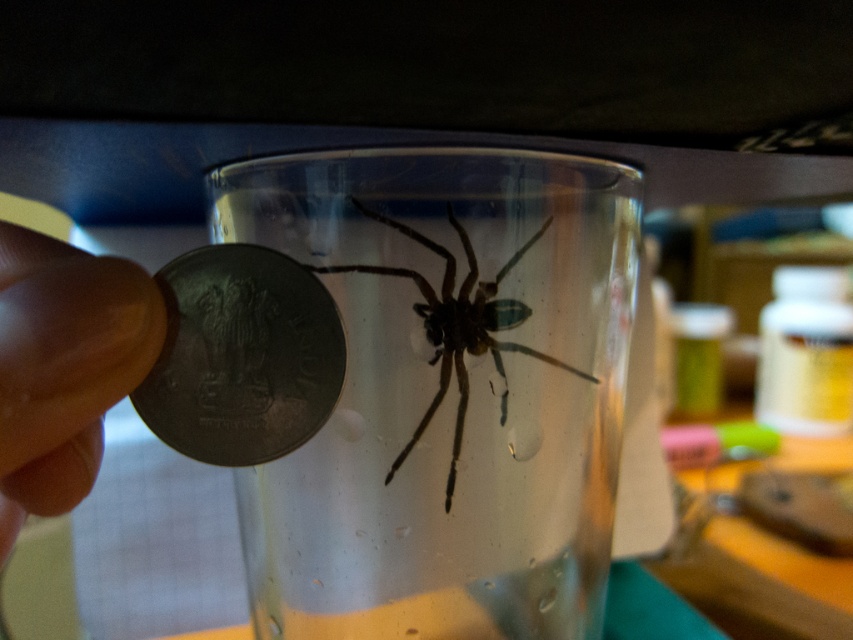
Measure the distance between point (627, 240) and camera.

10.52 inches

Consider the image. Is the position of transparent glass at center less distant than that of metallic gray coin at lower left?

No, transparent glass at center is behind metallic gray coin at lower left.

Locate an element on the screen. The image size is (853, 640). transparent glass at center is located at coordinates (445, 392).

Can you confirm if matte metallic coin at left is taller than metallic gray coin at lower left?

No.

Does point (172, 330) come behind point (4, 536)?

No.

Does point (267, 392) come in front of point (94, 323)?

No, (267, 392) is further to viewer.

Where is `matte metallic coin at left`? Image resolution: width=853 pixels, height=640 pixels. matte metallic coin at left is located at coordinates (242, 356).

Who is taller, matte metallic coin at left or translucent glass spider at center?

translucent glass spider at center

Measure the distance from matte metallic coin at left to translucent glass spider at center.

matte metallic coin at left and translucent glass spider at center are 2.94 inches apart.

Which is in front, point (332, 323) or point (372, 218)?

Point (332, 323) is in front.

Image resolution: width=853 pixels, height=640 pixels. I want to click on matte metallic coin at left, so click(242, 356).